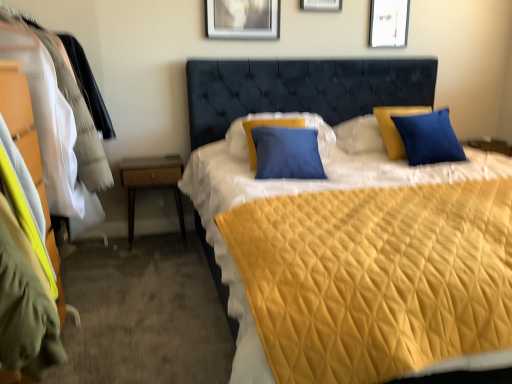
In order to face metallic silver picture frame at upper center, which appears as the third picture frame when viewed from the right, should I rotate leftwards or rightwards?

Turn left by 1.511 degrees to look at metallic silver picture frame at upper center, which appears as the third picture frame when viewed from the right.

The image size is (512, 384). I want to click on matte silver picture frame at upper center, which ranks as the 2th picture frame in right-to-left order, so click(x=321, y=5).

The height and width of the screenshot is (384, 512). What do you see at coordinates (67, 102) in the screenshot? I see `matte wood dresser at left` at bounding box center [67, 102].

The width and height of the screenshot is (512, 384). What do you see at coordinates (279, 119) in the screenshot? I see `blue matte pillow at center` at bounding box center [279, 119].

This screenshot has height=384, width=512. What do you see at coordinates (151, 184) in the screenshot? I see `wooden nightstand at lower left` at bounding box center [151, 184].

Identify the location of wooden nightstand at lower left. (151, 184).

Locate an element on the screen. The image size is (512, 384). metallic silver picture frame at upper center, positioned as the first picture frame in left-to-right order is located at coordinates (243, 19).

Is point (250, 6) closer or farther from the camera than point (305, 9)?

Point (250, 6) appears to be closer to the viewer than point (305, 9).

In terms of size, does metallic silver picture frame at upper center, positioned as the first picture frame in left-to-right order, appear bigger or smaller than matte silver picture frame at upper center, which ranks as the 2th picture frame in right-to-left order?

Clearly, metallic silver picture frame at upper center, positioned as the first picture frame in left-to-right order, is smaller in size than matte silver picture frame at upper center, which ranks as the 2th picture frame in right-to-left order.

From the picture: Does metallic silver picture frame at upper center, positioned as the first picture frame in left-to-right order, turn towards matte silver picture frame at upper center, arranged as the 2th picture frame when viewed from the left?

No.

Based on the photo, from the image's perspective, is metallic silver picture frame at upper center, which appears as the third picture frame when viewed from the right, under matte silver picture frame at upper center, which ranks as the 2th picture frame in right-to-left order?

Correct, metallic silver picture frame at upper center, which appears as the third picture frame when viewed from the right, appears lower than matte silver picture frame at upper center, which ranks as the 2th picture frame in right-to-left order, in the image.

Is wooden nightstand at lower left oriented away from blue matte pillow at center?

No, blue matte pillow at center is not at the back of wooden nightstand at lower left.

From the image's perspective, which is above, wooden nightstand at lower left or blue matte pillow at center?

blue matte pillow at center appears higher in the image.

Considering the relative sizes of wooden nightstand at lower left and blue matte pillow at center in the image provided, is wooden nightstand at lower left shorter than blue matte pillow at center?

No.

Which object is more forward, wooden nightstand at lower left or blue matte pillow at center?

blue matte pillow at center.

Looking at this image, is the surface of blue matte pillow at center in direct contact with white paper at upper center, which is the 3th picture frame in left-to-right order?

No, blue matte pillow at center is not with white paper at upper center, which is the 3th picture frame in left-to-right order.

How far apart are blue matte pillow at center and white paper at upper center, which is the 3th picture frame in left-to-right order?

3.81 feet.

The image size is (512, 384). I want to click on the 2nd picture frame counting from the right of the blue matte pillow at center, so click(x=389, y=23).

From a real-world perspective, is blue matte pillow at center positioned over white paper at upper center, positioned as the 1th picture frame in right-to-left order, based on gravity?

No, from a real-world perspective, blue matte pillow at center is not on top of white paper at upper center, positioned as the 1th picture frame in right-to-left order.

Based on the photo, can wooden nightstand at lower left be found inside metallic silver picture frame at upper center, which appears as the third picture frame when viewed from the right?

That's incorrect, wooden nightstand at lower left is not inside metallic silver picture frame at upper center, which appears as the third picture frame when viewed from the right.

Considering the relative sizes of metallic silver picture frame at upper center, which appears as the third picture frame when viewed from the right, and wooden nightstand at lower left in the image provided, is metallic silver picture frame at upper center, which appears as the third picture frame when viewed from the right, smaller than wooden nightstand at lower left?

Indeed, metallic silver picture frame at upper center, which appears as the third picture frame when viewed from the right, has a smaller size compared to wooden nightstand at lower left.

Is point (261, 34) closer to viewer compared to point (126, 180)?

No, it is behind (126, 180).

Considering their positions, is metallic silver picture frame at upper center, positioned as the first picture frame in left-to-right order, located in front of or behind wooden nightstand at lower left?

Clearly, metallic silver picture frame at upper center, positioned as the first picture frame in left-to-right order, is behind wooden nightstand at lower left.

Considering the sizes of objects blue matte pillow at center and matte silver picture frame at upper center, arranged as the 2th picture frame when viewed from the left, in the image provided, who is smaller, blue matte pillow at center or matte silver picture frame at upper center, arranged as the 2th picture frame when viewed from the left,?

Smaller between the two is matte silver picture frame at upper center, arranged as the 2th picture frame when viewed from the left.

From a real-world perspective, is blue matte pillow at center positioned above or below matte silver picture frame at upper center, which ranks as the 2th picture frame in right-to-left order?

blue matte pillow at center is below matte silver picture frame at upper center, which ranks as the 2th picture frame in right-to-left order.

Between blue matte pillow at center and matte silver picture frame at upper center, which ranks as the 2th picture frame in right-to-left order, which one has smaller width?

matte silver picture frame at upper center, which ranks as the 2th picture frame in right-to-left order, is thinner.

Which object is further away from the camera taking this photo, blue matte pillow at center or matte silver picture frame at upper center, arranged as the 2th picture frame when viewed from the left?

matte silver picture frame at upper center, arranged as the 2th picture frame when viewed from the left, is more distant.

Does white paper at upper center, which is the 3th picture frame in left-to-right order, turn towards metallic silver picture frame at upper center, positioned as the first picture frame in left-to-right order?

No, white paper at upper center, which is the 3th picture frame in left-to-right order, is not oriented towards metallic silver picture frame at upper center, positioned as the first picture frame in left-to-right order.

Which is behind, point (402, 26) or point (213, 0)?

The point (402, 26) is farther from the camera.

Is white paper at upper center, positioned as the 1th picture frame in right-to-left order, touching metallic silver picture frame at upper center, positioned as the first picture frame in left-to-right order?

There is a gap between white paper at upper center, positioned as the 1th picture frame in right-to-left order, and metallic silver picture frame at upper center, positioned as the first picture frame in left-to-right order.

From the image's perspective, who appears lower, white paper at upper center, positioned as the 1th picture frame in right-to-left order, or metallic silver picture frame at upper center, which appears as the third picture frame when viewed from the right?

metallic silver picture frame at upper center, which appears as the third picture frame when viewed from the right, is shown below in the image.

Is white paper at upper center, positioned as the 1th picture frame in right-to-left order, aimed at matte wood dresser at left?

No, white paper at upper center, positioned as the 1th picture frame in right-to-left order, is not facing towards matte wood dresser at left.

Is white paper at upper center, positioned as the 1th picture frame in right-to-left order, at the left side of matte wood dresser at left?

No.

Which is in front, white paper at upper center, positioned as the 1th picture frame in right-to-left order, or matte wood dresser at left?

matte wood dresser at left is more forward.

From a real-world perspective, is white paper at upper center, positioned as the 1th picture frame in right-to-left order, physically above matte wood dresser at left?

Yes, from a real-world perspective, white paper at upper center, positioned as the 1th picture frame in right-to-left order, is on top of matte wood dresser at left.

The width and height of the screenshot is (512, 384). I want to click on picture frame in front of the matte silver picture frame at upper center, which ranks as the 2th picture frame in right-to-left order, so click(243, 19).

Locate an element on the screen. pillow above the wooden nightstand at lower left (from a real-world perspective) is located at coordinates (279, 119).

From the image, which object appears to be nearer to wooden nightstand at lower left, blue matte pillow at center or metallic silver picture frame at upper center, which appears as the third picture frame when viewed from the right?

Among the two, blue matte pillow at center is located nearer to wooden nightstand at lower left.

Which object lies further to the anchor point white paper at upper center, which is the 3th picture frame in left-to-right order, matte wood dresser at left or matte silver picture frame at upper center, arranged as the 2th picture frame when viewed from the left?

matte wood dresser at left lies further to white paper at upper center, which is the 3th picture frame in left-to-right order, than the other object.

From the image, which object appears to be farther from metallic silver picture frame at upper center, positioned as the first picture frame in left-to-right order, white paper at upper center, which is the 3th picture frame in left-to-right order, or blue matte pillow at center?

white paper at upper center, which is the 3th picture frame in left-to-right order, is positioned further to the anchor metallic silver picture frame at upper center, positioned as the first picture frame in left-to-right order.

Considering their positions, is white paper at upper center, positioned as the 1th picture frame in right-to-left order, positioned closer to blue matte pillow at center than wooden nightstand at lower left?

wooden nightstand at lower left lies closer to blue matte pillow at center than the other object.

Looking at the image, which one is located further to matte silver picture frame at upper center, arranged as the 2th picture frame when viewed from the left, matte wood dresser at left or blue matte pillow at center?

matte wood dresser at left lies further to matte silver picture frame at upper center, arranged as the 2th picture frame when viewed from the left, than the other object.

Which object lies nearer to the anchor point white paper at upper center, which is the 3th picture frame in left-to-right order, metallic silver picture frame at upper center, positioned as the first picture frame in left-to-right order, or blue matte pillow at center?

Among the two, metallic silver picture frame at upper center, positioned as the first picture frame in left-to-right order, is located nearer to white paper at upper center, which is the 3th picture frame in left-to-right order.

When comparing their distances from blue matte pillow at center, does matte wood dresser at left or metallic silver picture frame at upper center, positioned as the first picture frame in left-to-right order, seem further?

Based on the image, matte wood dresser at left appears to be further to blue matte pillow at center.

Estimate the real-world distances between objects in this image. Which object is further from white paper at upper center, which is the 3th picture frame in left-to-right order, matte silver picture frame at upper center, arranged as the 2th picture frame when viewed from the left, or metallic silver picture frame at upper center, positioned as the first picture frame in left-to-right order?

metallic silver picture frame at upper center, positioned as the first picture frame in left-to-right order, is positioned further to the anchor white paper at upper center, which is the 3th picture frame in left-to-right order.

Locate an element on the screen. Image resolution: width=512 pixels, height=384 pixels. pillow between matte wood dresser at left and white paper at upper center, positioned as the 1th picture frame in right-to-left order, in the horizontal direction is located at coordinates (279, 119).

Locate an element on the screen. This screenshot has height=384, width=512. nightstand between matte wood dresser at left and metallic silver picture frame at upper center, positioned as the first picture frame in left-to-right order, in the front-back direction is located at coordinates (151, 184).

Image resolution: width=512 pixels, height=384 pixels. What are the coordinates of `pillow between metallic silver picture frame at upper center, which appears as the third picture frame when viewed from the right, and white paper at upper center, positioned as the 1th picture frame in right-to-left order, from left to right` in the screenshot? It's located at (279, 119).

You are a GUI agent. You are given a task and a screenshot of the screen. Output one action in this format:
    pyautogui.click(x=<x>, y=<y>)
    Task: Click on the pillow between matte silver picture frame at upper center, arranged as the 2th picture frame when viewed from the left, and wooden nightstand at lower left vertically
    The width and height of the screenshot is (512, 384).
    Given the screenshot: What is the action you would take?
    pyautogui.click(x=279, y=119)